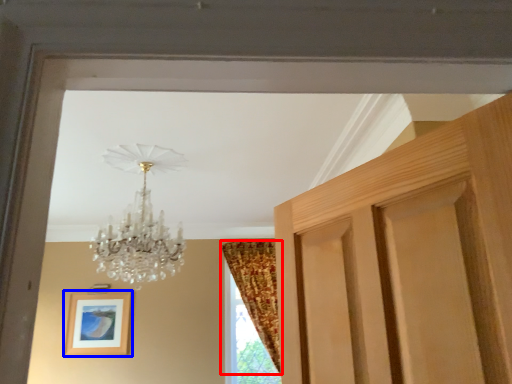
Question: Which point is closer to the camera, curtain (highlighted by a red box) or picture frame (highlighted by a blue box)?

Choices:
 (A) curtain
 (B) picture frame

Answer: (A)